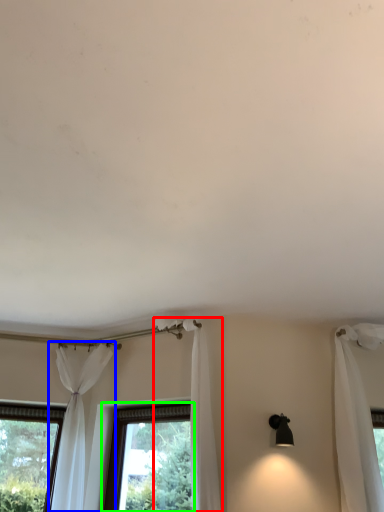
Question: Considering the real-world distances, which object is farthest from curtain (highlighted by a red box)? curtain (highlighted by a blue box) or window (highlighted by a green box)?

Choices:
 (A) curtain
 (B) window

Answer: (A)